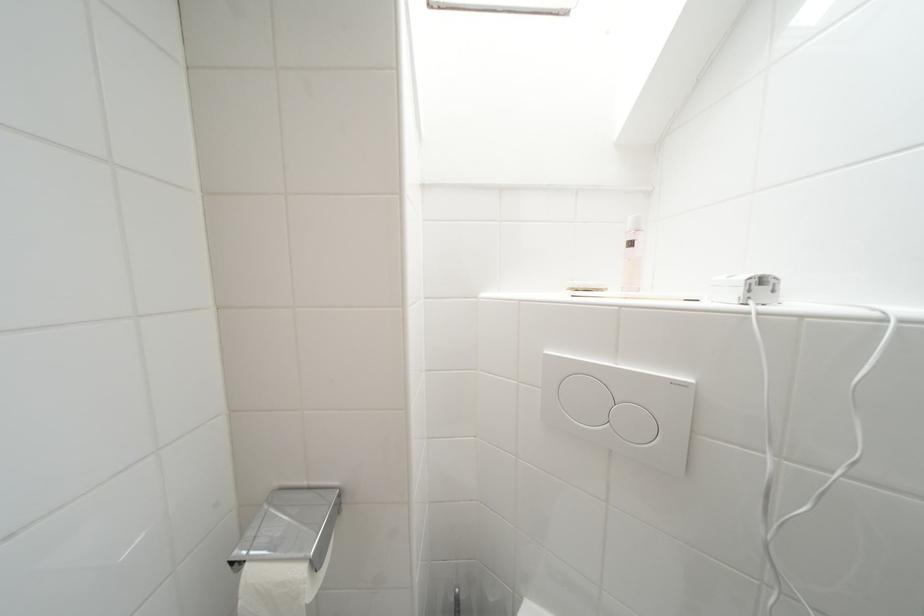
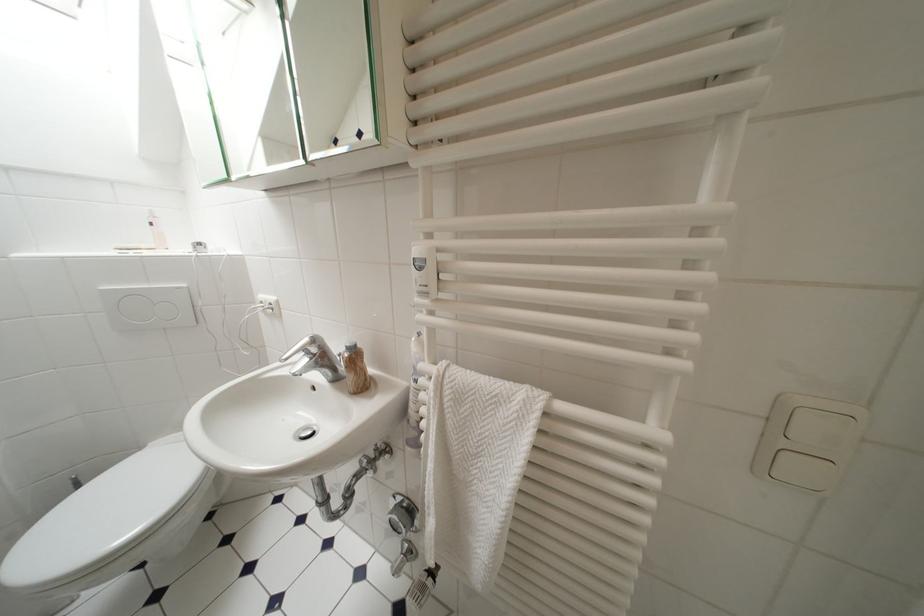
The point at (638, 246) is marked in the first image. Where is the corresponding point in the second image?

(159, 227)